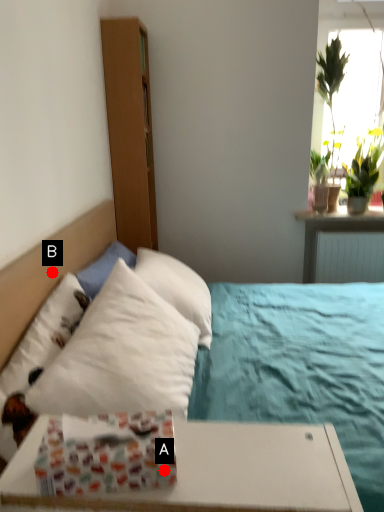
Question: Two points are circled on the image, labeled by A and B beside each circle. Which point is closer to the camera?

Choices:
 (A) A is closer
 (B) B is closer

Answer: (A)